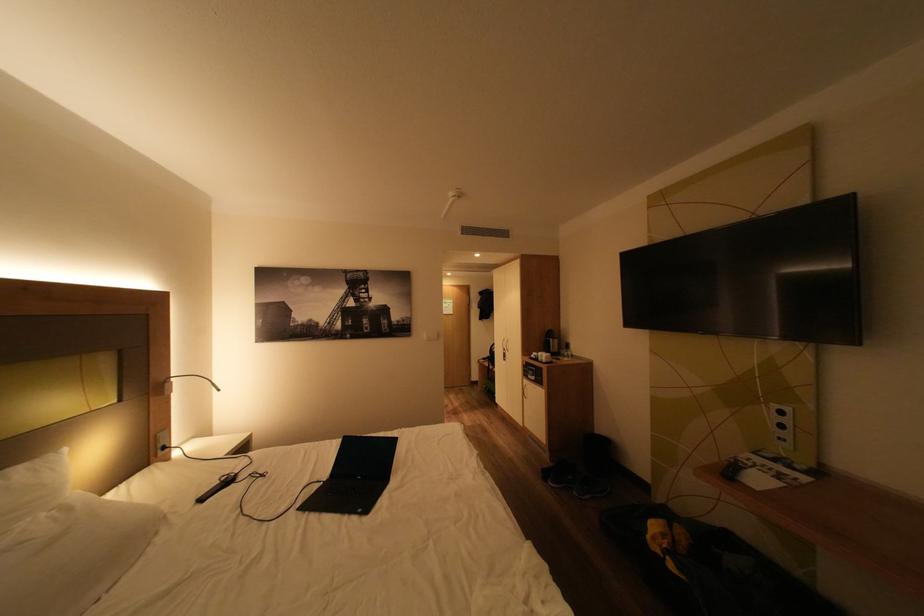
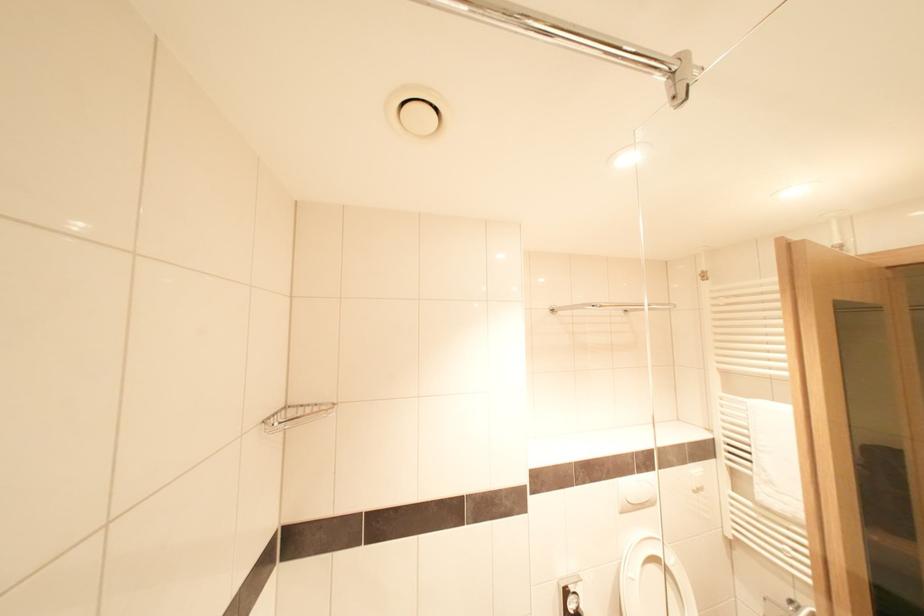
In a continuous first-person perspective shot, in which direction is the camera moving?

The movement direction of the cameraman is left, forward.